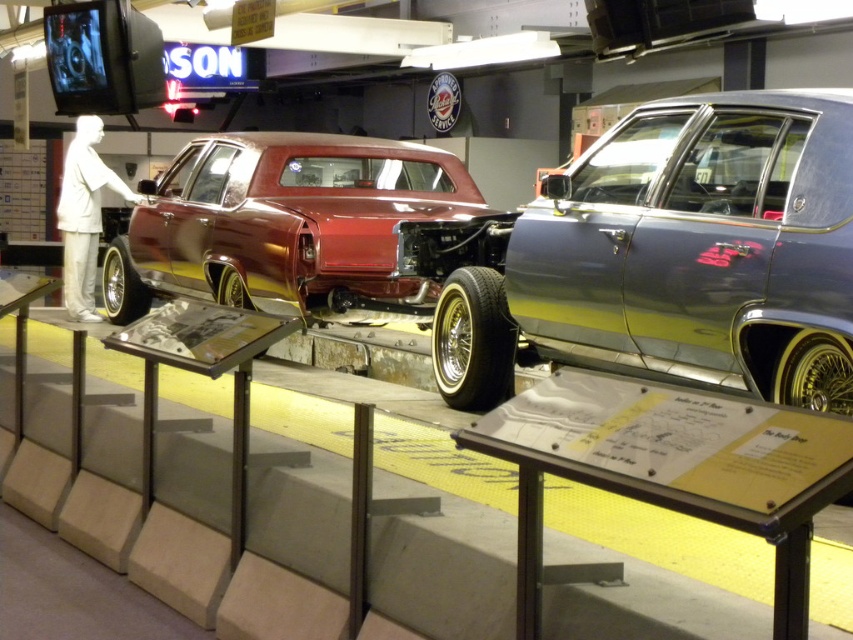
Does shiny maroon body at center appear over white matte suit at left?

No, shiny maroon body at center is not above white matte suit at left.

Looking at this image, does shiny maroon body at center have a lesser height compared to white matte suit at left?

Yes, shiny maroon body at center is shorter than white matte suit at left.

Describe the element at coordinates (285, 225) in the screenshot. The height and width of the screenshot is (640, 853). I see `shiny maroon body at center` at that location.

This screenshot has width=853, height=640. Find the location of `shiny maroon body at center`. shiny maroon body at center is located at coordinates (285, 225).

Who is shorter, metallic silver car at right or shiny maroon body at center?

metallic silver car at right

Identify the location of metallic silver car at right. (701, 246).

This screenshot has height=640, width=853. Find the location of `metallic silver car at right`. metallic silver car at right is located at coordinates tap(701, 246).

Which is more to the right, metallic silver car at right or white matte suit at left?

Positioned to the right is metallic silver car at right.

Which is behind, point (653, 300) or point (71, 227)?

Point (71, 227)

Image resolution: width=853 pixels, height=640 pixels. What are the coordinates of `metallic silver car at right` in the screenshot? It's located at (701, 246).

This screenshot has height=640, width=853. I want to click on metallic silver car at right, so click(x=701, y=246).